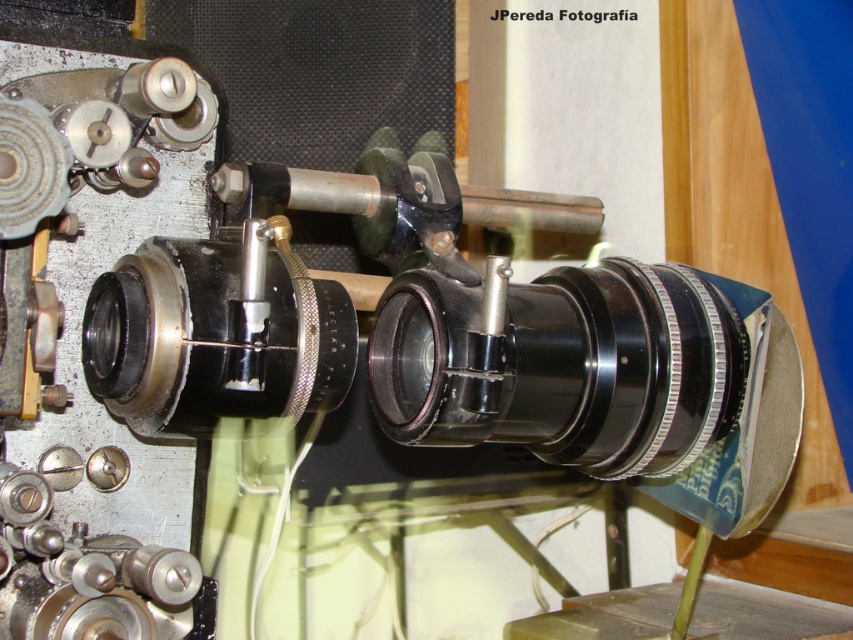
You are holding a tool that requires precise placement between the black metallic lens at center and the matte black lens at center. Which lens should you place the tool on top of to ensure stability?

The black metallic lens at center is much taller than the matte black lens at center, so placing the tool on top of the black metallic lens at center would provide a more stable base due to its height.

You are a technician working on a mechanical device. You need to replace the smaller lens first. Which lens should you choose between the black metallic lens at center and the matte black lens at center?

The matte black lens at center is smaller, so you should choose the matte black lens at center to replace first.

You are operating a mechanical device with two points labeled as point (426, 305) and point (225, 340). If you need to adjust the lens closest to the front, which point should you focus on?

Point (225, 340) is in front of point (426, 305), so you should focus on point (225, 340) to adjust the lens closest to the front.